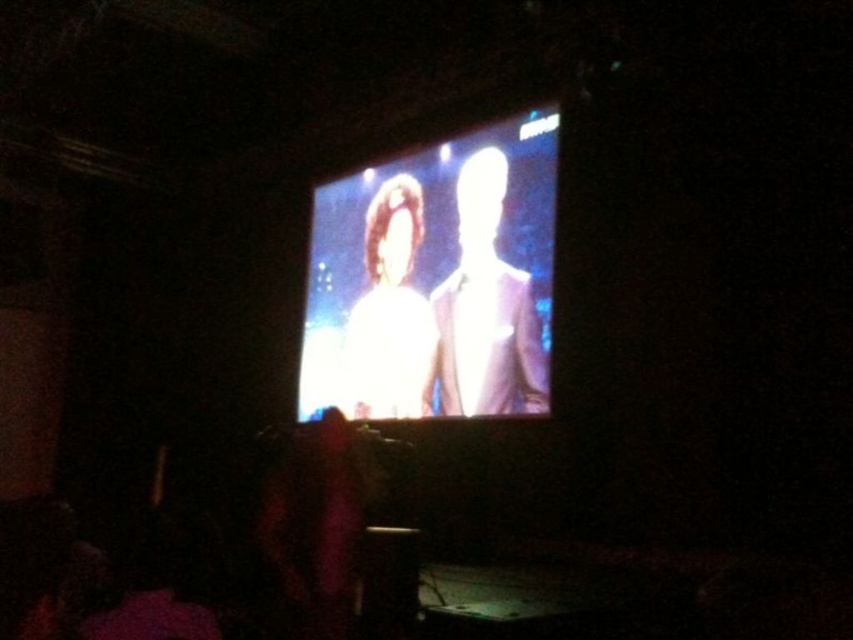
Consider the image. You are an event planner trying to set up a new projector. The screen is at the center of the room. You need to place a marker at point (434, 280). Where should you place it?

The point (434, 280) should be placed on the bright glossy screen at center because the Objects Description states that it is located there.

You are standing in a room with a large screen. You want to position yourself directly in front of the bright glossy screen at center to get the best view. According to the coordinates provided, where should you stand relative to the room?

You should stand at the coordinates point (434,280) to be directly in front of the bright glossy screen at center for the best view.